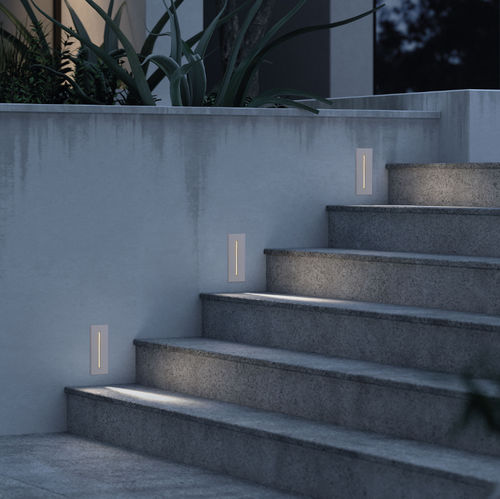
Identify the location of stairs. (267, 449), (316, 405), (383, 339), (398, 286), (416, 234), (440, 191).